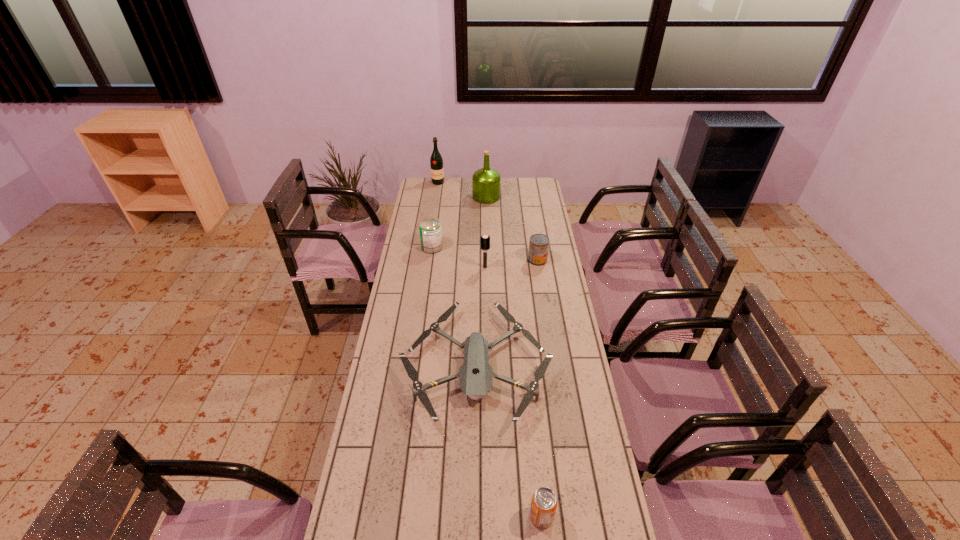
In order to click on free spot between the drone and the nearest object in this screenshot , I will do `click(509, 441)`.

Locate an element on the screen. The height and width of the screenshot is (540, 960). free point between the farthest object and the shortest object is located at coordinates pyautogui.click(x=457, y=274).

Point out which object is positioned as the fourth nearest to the hairbrush. Please provide its 2D coordinates. Your answer should be formatted as a tuple, i.e. [(x, y)], where the tuple contains the x and y coordinates of a point satisfying the conditions above.

[(486, 181)]

Identify the location of object that ranks as the closest to the farthest object. This screenshot has height=540, width=960. (486, 181).

The image size is (960, 540). In order to click on free space that satisfies the following two spatial constraints: 1. on the front-facing side of the hairbrush; 2. on the right side of the farthest object in this screenshot , I will do `click(425, 267)`.

Where is `vacant region that satisfies the following two spatial constraints: 1. on the front-facing side of the shorter can; 2. on the left side of the liquor`? vacant region that satisfies the following two spatial constraints: 1. on the front-facing side of the shorter can; 2. on the left side of the liquor is located at coordinates (427, 260).

At what (x,y) coordinates should I click in order to perform the action: click on free spot that satisfies the following two spatial constraints: 1. on the front-facing side of the liquor; 2. on the left side of the nearest object. Please return your answer as a coordinate pair (x, y). This screenshot has height=540, width=960. Looking at the image, I should click on (390, 516).